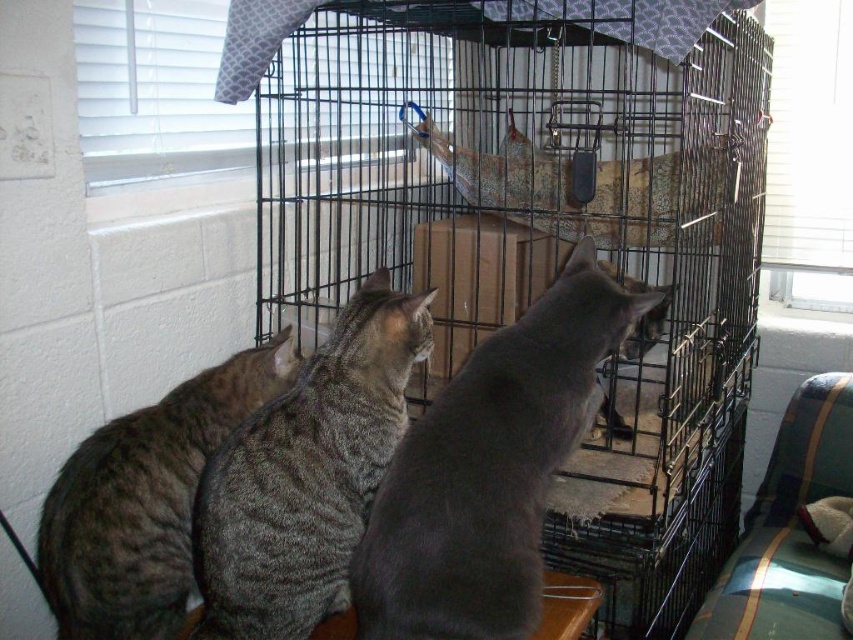
Question: Among these objects, which one is farthest from the camera?

Choices:
 (A) gray matte fur cat at center
 (B) gray striped cat at center

Answer: (B)

Question: Can you confirm if black wire cage at center is wider than gray matte fur cat at center?

Choices:
 (A) no
 (B) yes

Answer: (B)

Question: Which object appears farthest from the camera in this image?

Choices:
 (A) gray striped cat at left
 (B) gray striped cat at center
 (C) black wire cage at center
 (D) gray matte fur cat at center

Answer: (C)

Question: Is black wire cage at center below gray striped cat at left?

Choices:
 (A) no
 (B) yes

Answer: (A)

Question: Does gray matte fur cat at center have a smaller size compared to gray striped cat at center?

Choices:
 (A) yes
 (B) no

Answer: (B)

Question: Which of the following is the farthest from the observer?

Choices:
 (A) gray striped cat at left
 (B) gray matte fur cat at center
 (C) gray striped cat at center

Answer: (A)